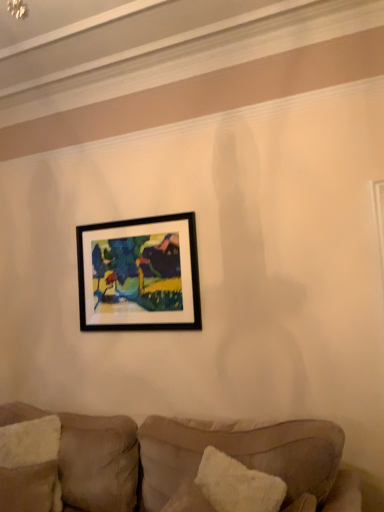
At what (x,y) coordinates should I click in order to perform the action: click on black matte picture frame at upper center. Please return your answer as a coordinate pair (x, y). The image size is (384, 512). Looking at the image, I should click on (139, 274).

Image resolution: width=384 pixels, height=512 pixels. What are the coordinates of `white textured pillow at lower left, which is the 2th pillow from right to left` in the screenshot? It's located at (30, 465).

Identify the location of black matte picture frame at upper center. Image resolution: width=384 pixels, height=512 pixels. (139, 274).

Which is closer, (x=46, y=433) or (x=346, y=492)?

Point (x=46, y=433) appears to be farther away from the viewer than point (x=346, y=492).

Considering the sizes of white textured pillow at lower left, acting as the first pillow starting from the back, and velvet beige couch at lower center in the image, is white textured pillow at lower left, acting as the first pillow starting from the back, wider or thinner than velvet beige couch at lower center?

Clearly, white textured pillow at lower left, acting as the first pillow starting from the back, has less width compared to velvet beige couch at lower center.

Is white textured pillow at lower left, which is the 2th pillow from right to left, behind velvet beige couch at lower center?

That is True.

How different are the orientations of white textured pillow at lower left, which is counted as the 2th pillow, starting from the front, and velvet beige couch at lower center in degrees?

The angular difference between white textured pillow at lower left, which is counted as the 2th pillow, starting from the front, and velvet beige couch at lower center is 37.7 degrees.

From a real-world perspective, is velvet beige couch at lower center located beneath white textured pillow at lower left, which is counted as the 2th pillow, starting from the front?

Indeed, from a real-world perspective, velvet beige couch at lower center is positioned beneath white textured pillow at lower left, which is counted as the 2th pillow, starting from the front.

Is velvet beige couch at lower center positioned in front of white textured pillow at lower left, which is the 2th pillow from right to left?

Yes.

Locate an element on the screen. Image resolution: width=384 pixels, height=512 pixels. studio couch below the white textured pillow at lower left, which is the 2th pillow from right to left (from the image's perspective) is located at coordinates (158, 461).

From a real-world perspective, is white textured pillow at lower left, acting as the first pillow starting from the back, under white fluffy pillow at lower right, which is counted as the 1th pillow, starting from the front?

Indeed, from a real-world perspective, white textured pillow at lower left, acting as the first pillow starting from the back, is positioned beneath white fluffy pillow at lower right, which is counted as the 1th pillow, starting from the front.

Considering the sizes of objects white textured pillow at lower left, the 1th pillow positioned from the left, and white fluffy pillow at lower right, the second pillow when ordered from back to front, in the image provided, who is bigger, white textured pillow at lower left, the 1th pillow positioned from the left, or white fluffy pillow at lower right, the second pillow when ordered from back to front,?

With larger size is white fluffy pillow at lower right, the second pillow when ordered from back to front.

Considering the sizes of white textured pillow at lower left, the 1th pillow positioned from the left, and white fluffy pillow at lower right, which is counted as the 1th pillow, starting from the front, in the image, is white textured pillow at lower left, the 1th pillow positioned from the left, wider or thinner than white fluffy pillow at lower right, which is counted as the 1th pillow, starting from the front,?

Considering their sizes, white textured pillow at lower left, the 1th pillow positioned from the left, looks slimmer than white fluffy pillow at lower right, which is counted as the 1th pillow, starting from the front.

Between white textured pillow at lower left, acting as the first pillow starting from the back, and white fluffy pillow at lower right, which is counted as the 2th pillow, starting from the left, which one appears on the left side from the viewer's perspective?

white textured pillow at lower left, acting as the first pillow starting from the back.

Is white fluffy pillow at lower right, the second pillow when ordered from back to front, far from velvet beige couch at lower center?

No.

From the image's perspective, relative to velvet beige couch at lower center, is white fluffy pillow at lower right, which is counted as the 2th pillow, starting from the left, above or below?

From the image's perspective, white fluffy pillow at lower right, which is counted as the 2th pillow, starting from the left, appears above velvet beige couch at lower center.

From a real-world perspective, who is located lower, white fluffy pillow at lower right, the second pillow when ordered from back to front, or velvet beige couch at lower center?

velvet beige couch at lower center, from a real-world perspective.

Which is less distant, [201,476] or [78,449]?

Point [201,476].

Looking at this image, from the image's perspective, is black matte picture frame at upper center under velvet beige couch at lower center?

No, from the image's perspective, black matte picture frame at upper center is not below velvet beige couch at lower center.

Locate an element on the screen. picture frame on the right of velvet beige couch at lower center is located at coordinates (139, 274).

Based on the photo, considering the sizes of black matte picture frame at upper center and velvet beige couch at lower center in the image, is black matte picture frame at upper center bigger or smaller than velvet beige couch at lower center?

In the image, black matte picture frame at upper center appears to be smaller than velvet beige couch at lower center.

Is black matte picture frame at upper center wider than velvet beige couch at lower center?

In fact, black matte picture frame at upper center might be narrower than velvet beige couch at lower center.

Based on their sizes in the image, would you say black matte picture frame at upper center is bigger or smaller than white fluffy pillow at lower right, which appears as the 1th pillow when viewed from the right?

Considering their sizes, black matte picture frame at upper center takes up more space than white fluffy pillow at lower right, which appears as the 1th pillow when viewed from the right.

Is black matte picture frame at upper center inside the boundaries of white fluffy pillow at lower right, which appears as the 1th pillow when viewed from the right, or outside?

black matte picture frame at upper center exists outside the volume of white fluffy pillow at lower right, which appears as the 1th pillow when viewed from the right.

Could you tell me if black matte picture frame at upper center is facing white fluffy pillow at lower right, which is counted as the 2th pillow, starting from the left?

No, black matte picture frame at upper center is not turned towards white fluffy pillow at lower right, which is counted as the 2th pillow, starting from the left.

Based on the photo, between black matte picture frame at upper center and white fluffy pillow at lower right, which is counted as the 2th pillow, starting from the left, which one has smaller width?

Thinner between the two is black matte picture frame at upper center.

Is black matte picture frame at upper center further to the viewer compared to white textured pillow at lower left, acting as the first pillow starting from the back?

Yes, it is.

Is black matte picture frame at upper center looking in the opposite direction of white textured pillow at lower left, the 1th pillow positioned from the left?

No, black matte picture frame at upper center's orientation is not away from white textured pillow at lower left, the 1th pillow positioned from the left.

From a real-world perspective, which object rests below the other?

white textured pillow at lower left, acting as the first pillow starting from the back, from a real-world perspective.

Where is `picture frame that appears on the right of white textured pillow at lower left, which is the 2th pillow from right to left`? picture frame that appears on the right of white textured pillow at lower left, which is the 2th pillow from right to left is located at coordinates (139, 274).

Where is `studio couch lying in front of the white textured pillow at lower left, the 1th pillow positioned from the left`? studio couch lying in front of the white textured pillow at lower left, the 1th pillow positioned from the left is located at coordinates (158, 461).

At what (x,y) coordinates should I click in order to perform the action: click on pillow that is the 2nd one when counting backward from the velvet beige couch at lower center. Please return your answer as a coordinate pair (x, y). This screenshot has width=384, height=512. Looking at the image, I should click on (30, 465).

Looking at the image, which one is located further to velvet beige couch at lower center, black matte picture frame at upper center or white textured pillow at lower left, the 1th pillow positioned from the left?

black matte picture frame at upper center is positioned further to the anchor velvet beige couch at lower center.

Looking at the image, which one is located closer to black matte picture frame at upper center, velvet beige couch at lower center or white textured pillow at lower left, the 1th pillow positioned from the left?

velvet beige couch at lower center is positioned closer to the anchor black matte picture frame at upper center.

From the picture: When comparing their distances from black matte picture frame at upper center, does velvet beige couch at lower center or white fluffy pillow at lower right, which is counted as the 1th pillow, starting from the front, seem further?

white fluffy pillow at lower right, which is counted as the 1th pillow, starting from the front, is positioned further to the anchor black matte picture frame at upper center.

From the image, which object appears to be farther from white fluffy pillow at lower right, which is counted as the 1th pillow, starting from the front, velvet beige couch at lower center or black matte picture frame at upper center?

black matte picture frame at upper center lies further to white fluffy pillow at lower right, which is counted as the 1th pillow, starting from the front, than the other object.

From the image, which object appears to be farther from white textured pillow at lower left, the 1th pillow positioned from the left, velvet beige couch at lower center or white fluffy pillow at lower right, the second pillow when ordered from back to front?

Based on the image, white fluffy pillow at lower right, the second pillow when ordered from back to front, appears to be further to white textured pillow at lower left, the 1th pillow positioned from the left.

Which object lies nearer to the anchor point velvet beige couch at lower center, white fluffy pillow at lower right, which appears as the 1th pillow when viewed from the right, or black matte picture frame at upper center?

white fluffy pillow at lower right, which appears as the 1th pillow when viewed from the right, is closer to velvet beige couch at lower center.

Based on their spatial positions, is white textured pillow at lower left, which is counted as the 2th pillow, starting from the front, or white fluffy pillow at lower right, which appears as the 1th pillow when viewed from the right, further from black matte picture frame at upper center?

Based on the image, white fluffy pillow at lower right, which appears as the 1th pillow when viewed from the right, appears to be further to black matte picture frame at upper center.

Estimate the real-world distances between objects in this image. Which object is closer to velvet beige couch at lower center, white textured pillow at lower left, acting as the first pillow starting from the back, or white fluffy pillow at lower right, the second pillow when ordered from back to front?

Based on the image, white textured pillow at lower left, acting as the first pillow starting from the back, appears to be nearer to velvet beige couch at lower center.

Identify the location of pillow positioned between white fluffy pillow at lower right, which appears as the 1th pillow when viewed from the right, and black matte picture frame at upper center from near to far. This screenshot has width=384, height=512. (30, 465).

Identify the location of studio couch between white textured pillow at lower left, which is the 2th pillow from right to left, and white fluffy pillow at lower right, which appears as the 1th pillow when viewed from the right, in the horizontal direction. (158, 461).